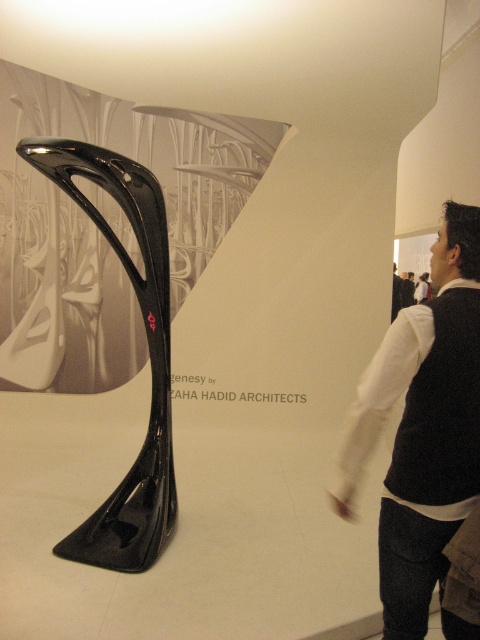
Who is taller, black fabric vest at center or glossy carbon fiber sculpture at center?

With more height is glossy carbon fiber sculpture at center.

At what (x,y) coordinates should I click in order to perform the action: click on black fabric vest at center. Please return your answer as a coordinate pair (x, y). Image resolution: width=480 pixels, height=640 pixels. Looking at the image, I should click on (422, 428).

Where is `black fabric vest at center`? black fabric vest at center is located at coordinates (422, 428).

The height and width of the screenshot is (640, 480). Identify the location of black fabric vest at center. (422, 428).